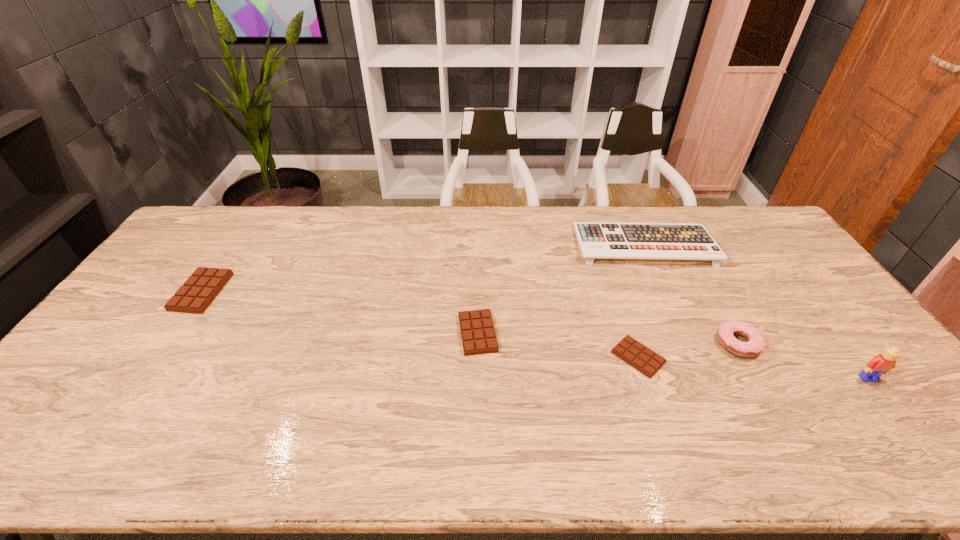
Image resolution: width=960 pixels, height=540 pixels. I want to click on the leftmost object, so click(200, 289).

You are a GUI agent. You are given a task and a screenshot of the screen. Output one action in this format:
    pyautogui.click(x=<x>, y=<y>)
    Task: Click on the leftmost candy bar
    
    Given the screenshot: What is the action you would take?
    pyautogui.click(x=200, y=289)

You are a GUI agent. You are given a task and a screenshot of the screen. Output one action in this format:
    pyautogui.click(x=<x>, y=<y>)
    Task: Click on the second candy bar from right to left
    Image resolution: width=960 pixels, height=540 pixels.
    Given the screenshot: What is the action you would take?
    pyautogui.click(x=478, y=335)

Find the location of a particular element. The image size is (960, 540). the second tallest candy bar is located at coordinates (478, 335).

The width and height of the screenshot is (960, 540). In order to click on the shortest candy bar in this screenshot , I will do `click(634, 353)`.

At what (x,y) coordinates should I click in order to perform the action: click on the shortest object. Please return your answer as a coordinate pair (x, y). Looking at the image, I should click on (634, 353).

Find the location of a particular element. The width and height of the screenshot is (960, 540). doughnut is located at coordinates (755, 344).

You are a GUI agent. You are given a task and a screenshot of the screen. Output one action in this format:
    pyautogui.click(x=<x>, y=<y>)
    Task: Click on the farthest object
    This screenshot has height=540, width=960.
    Given the screenshot: What is the action you would take?
    pyautogui.click(x=597, y=240)

Where is `Lego`? The width and height of the screenshot is (960, 540). Lego is located at coordinates (886, 362).

You are a GUI agent. You are given a task and a screenshot of the screen. Output one action in this format:
    pyautogui.click(x=<x>, y=<y>)
    Task: Click on the tallest object
    This screenshot has width=960, height=540.
    Given the screenshot: What is the action you would take?
    pyautogui.click(x=886, y=362)